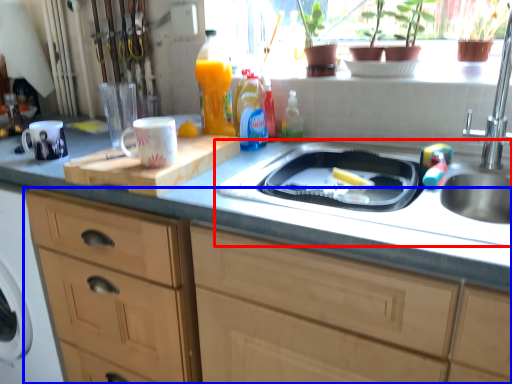
Question: Which point is closer to the camera, sink (highlighted by a red box) or cabinetry (highlighted by a blue box)?

Choices:
 (A) sink
 (B) cabinetry

Answer: (B)